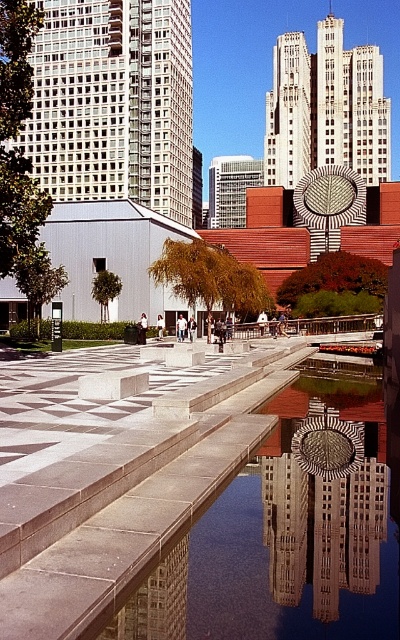
Question: Where is smooth concrete waterway at center located in relation to reflective glass sculpture at center in the image?

Choices:
 (A) below
 (B) above

Answer: (A)

Question: Which of the following is the closest to the observer?

Choices:
 (A) (362, 474)
 (B) (294, 609)

Answer: (B)

Question: Is smooth concrete waterway at center further to the viewer compared to reflective glass sculpture at center?

Choices:
 (A) no
 (B) yes

Answer: (A)

Question: Which of the following is the farthest from the observer?

Choices:
 (A) reflective glass sculpture at center
 (B) smooth concrete waterway at center

Answer: (A)

Question: Is smooth concrete waterway at center below reflective glass sculpture at center?

Choices:
 (A) yes
 (B) no

Answer: (A)

Question: Among these objects, which one is farthest from the camera?

Choices:
 (A) reflective glass sculpture at center
 (B) smooth concrete waterway at center

Answer: (A)